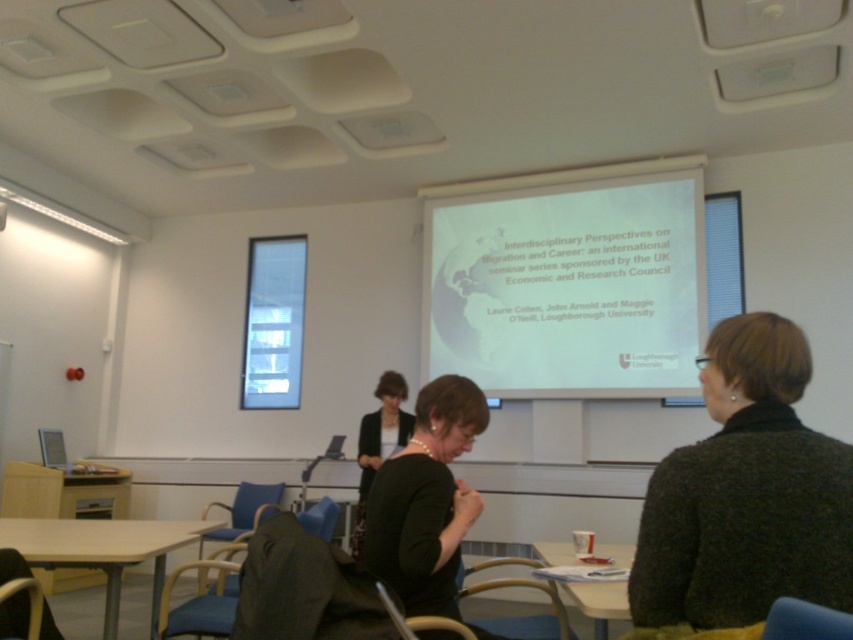
What do you see at coordinates (567, 282) in the screenshot? This screenshot has width=853, height=640. I see `white matte projector screen at upper center` at bounding box center [567, 282].

Can you confirm if white matte projector screen at upper center is smaller than wooden table at lower center?

Incorrect, white matte projector screen at upper center is not smaller in size than wooden table at lower center.

Who is more distant from viewer, [456,330] or [614,582]?

Point [456,330]

In order to click on white matte projector screen at upper center in this screenshot , I will do `click(567, 282)`.

Is white matte projector screen at upper center bigger than light brown wooden table at lower left?

Yes, white matte projector screen at upper center is bigger than light brown wooden table at lower left.

Is point (553, 234) positioned before point (54, 547)?

No, (553, 234) is behind (54, 547).

The image size is (853, 640). In order to click on white matte projector screen at upper center in this screenshot , I will do `click(567, 282)`.

Between white matte projector screen at upper center and dark green sweater at center, which one appears on the right side from the viewer's perspective?

Positioned to the right is white matte projector screen at upper center.

Who is lower down, white matte projector screen at upper center or dark green sweater at center?

dark green sweater at center is below.

Describe the element at coordinates (567, 282) in the screenshot. I see `white matte projector screen at upper center` at that location.

Find the location of a particular element. The width and height of the screenshot is (853, 640). white matte projector screen at upper center is located at coordinates (567, 282).